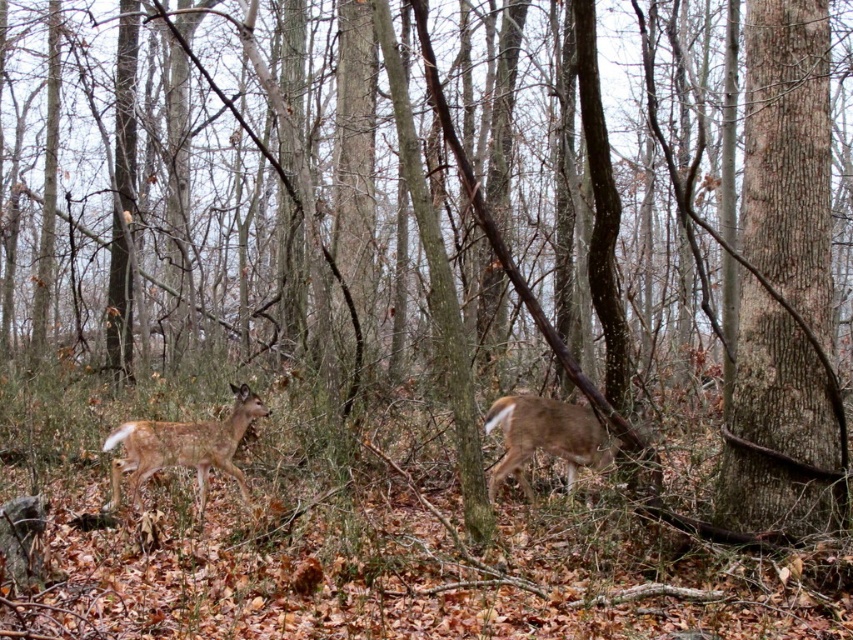
You are a wildlife photographer trying to capture both the fawn fur deer at center and the brown fur deer at center in a single frame. Which deer will require you to adjust your camera settings to account for its larger size?

The fawn fur deer at center has a larger width than the brown fur deer at center, so you will need to adjust your camera settings to accommodate its size to ensure it fits properly in the frame.

You are a wildlife photographer trying to capture both the fawn fur deer at center and the brown fur deer at center in a single shot. Which deer will appear smaller in the photo?

The fawn fur deer at center will appear smaller in the photo because it occupies less space than the brown fur deer at center.